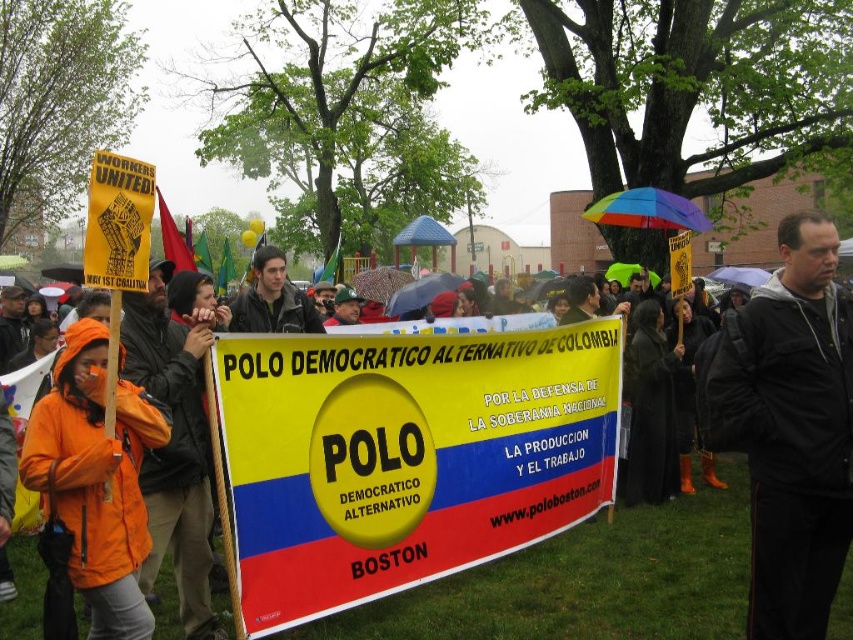
Question: Is the position of black jacket at center more distant than that of orange waterproof jacket at left?

Choices:
 (A) yes
 (B) no

Answer: (A)

Question: Does yellow fabric banner at center have a smaller size compared to black jacket at center?

Choices:
 (A) yes
 (B) no

Answer: (B)

Question: Which point is farther to the camera?

Choices:
 (A) [146, 524]
 (B) [735, 440]
 (C) [326, 528]

Answer: (C)

Question: Is black jacket at center further to the viewer compared to orange waterproof jacket at left?

Choices:
 (A) yes
 (B) no

Answer: (A)

Question: Among these objects, which one is nearest to the camera?

Choices:
 (A) black jacket at center
 (B) yellow fabric banner at center
 (C) orange waterproof jacket at left

Answer: (C)

Question: Considering the real-world distances, which object is closest to the yellow fabric banner at center?

Choices:
 (A) orange waterproof jacket at left
 (B) black jacket at center

Answer: (A)